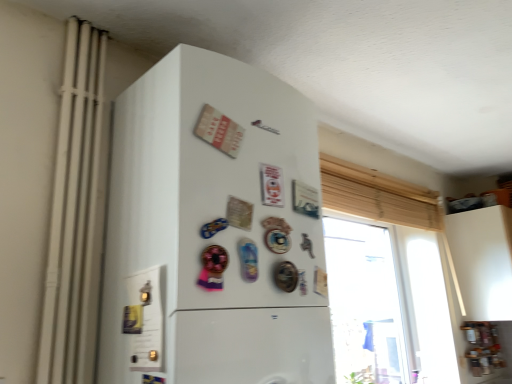
Question: From the image's perspective, is white matte refrigerator at center above or below white matte radiator at left?

Choices:
 (A) above
 (B) below

Answer: (B)

Question: From a real-world perspective, is white matte refrigerator at center above or below white matte radiator at left?

Choices:
 (A) above
 (B) below

Answer: (B)

Question: Estimate the real-world distances between objects in this image. Which object is closer to the white matte radiator at left?

Choices:
 (A) white matte refrigerator at center
 (B) translucent glass window at upper right

Answer: (A)

Question: Which object is positioned farthest from the translucent glass window at upper right?

Choices:
 (A) white matte refrigerator at center
 (B) white matte radiator at left

Answer: (B)